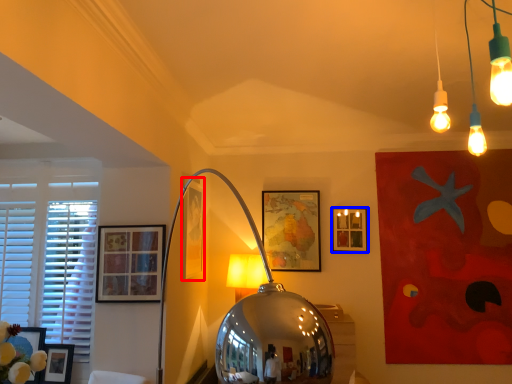
Question: Which of the following is the farthest to the observer, picture frame (highlighted by a red box) or picture frame (highlighted by a blue box)?

Choices:
 (A) picture frame
 (B) picture frame

Answer: (B)